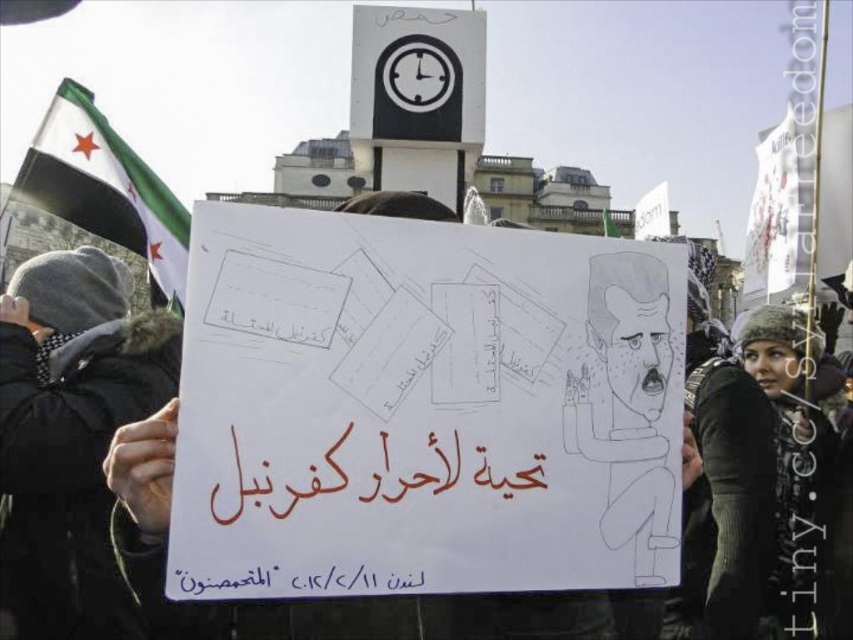
Is dark gray knit hat at upper left bigger than black paper at lower center?

Yes, dark gray knit hat at upper left is bigger than black paper at lower center.

Which is in front, point (827, 468) or point (200, 577)?

Point (200, 577)

Locate an element on the screen. The image size is (853, 640). dark gray knit hat at upper left is located at coordinates (798, 458).

Which is behind, point (102, 627) or point (410, 625)?

The point (102, 627) is more distant.

Is point (88, 621) closer to camera compared to point (247, 604)?

No, it is behind (247, 604).

Who is more forward, (86, 344) or (497, 602)?

Positioned in front is point (497, 602).

Where is `black woolen hat at upper left`? black woolen hat at upper left is located at coordinates (70, 435).

Which is more to the left, black woolen hat at upper left or white fabric flag at upper left?

Positioned to the left is white fabric flag at upper left.

Can you confirm if black woolen hat at upper left is wider than white fabric flag at upper left?

No, black woolen hat at upper left is not wider than white fabric flag at upper left.

Consider the image. Who is more distant from viewer, (74, 596) or (67, 93)?

The point (67, 93) is more distant.

What are the coordinates of `black woolen hat at upper left` in the screenshot? It's located at (70, 435).